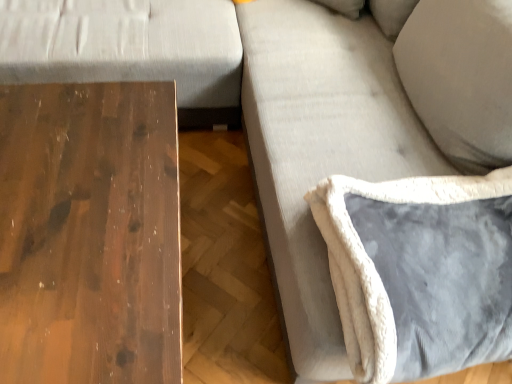
Question: Is velvet gray pillow at lower right situated inside shiny brown wood table at left or outside?

Choices:
 (A) inside
 (B) outside

Answer: (B)

Question: Considering their positions, is velvet gray pillow at lower right located in front of or behind shiny brown wood table at left?

Choices:
 (A) front
 (B) behind

Answer: (B)

Question: Is point (343, 283) closer or farther from the camera than point (14, 102)?

Choices:
 (A) closer
 (B) farther

Answer: (A)

Question: From the image's perspective, relative to velvet gray pillow at lower right, is shiny brown wood table at left above or below?

Choices:
 (A) below
 (B) above

Answer: (A)

Question: Considering the positions of point (169, 362) and point (359, 278), is point (169, 362) closer or farther from the camera than point (359, 278)?

Choices:
 (A) farther
 (B) closer

Answer: (B)

Question: From a real-world perspective, is shiny brown wood table at left physically located above or below velvet gray pillow at lower right?

Choices:
 (A) below
 (B) above

Answer: (A)

Question: Is shiny brown wood table at left spatially inside velvet gray pillow at lower right, or outside of it?

Choices:
 (A) inside
 (B) outside

Answer: (B)